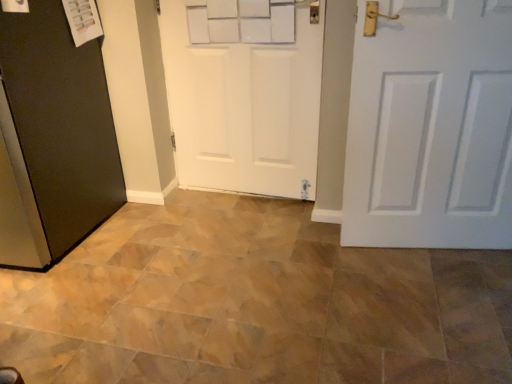
Identify the location of free point in front of white matte door at center, positioned as the second door in left-to-right order. (231, 230).